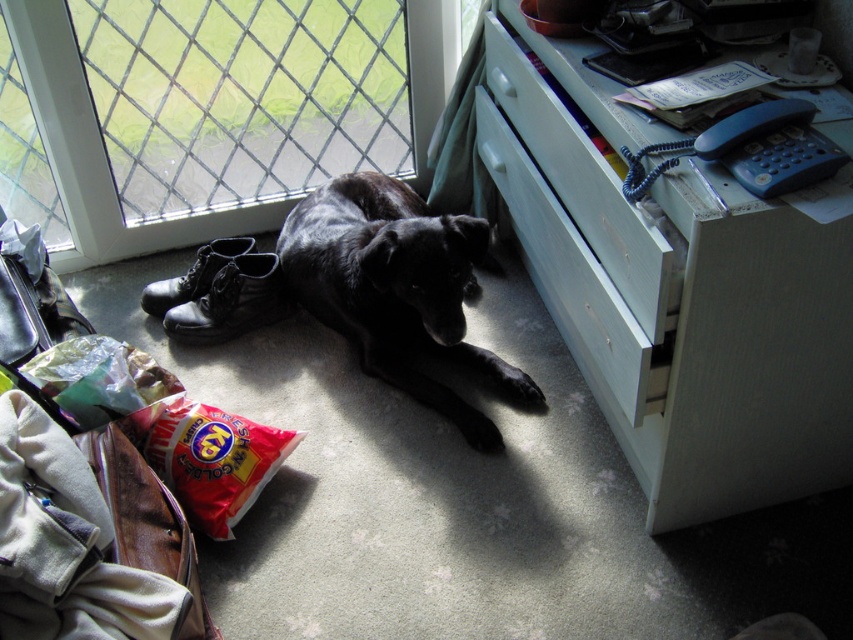
Is white wood file cabinet at right bigger than matte black boot at lower left?

Indeed, white wood file cabinet at right has a larger size compared to matte black boot at lower left.

Describe the element at coordinates (677, 291) in the screenshot. I see `white wood file cabinet at right` at that location.

Is point (718, 465) closer to viewer compared to point (224, 243)?

Yes, point (718, 465) is closer to viewer.

Where is `white wood file cabinet at right`? Image resolution: width=853 pixels, height=640 pixels. white wood file cabinet at right is located at coordinates 677,291.

Locate an element on the screen. velvet fabric bag at lower left is located at coordinates (67, 545).

Does velvet fabric bag at lower left have a smaller size compared to matte black boot at lower left?

No.

Can you confirm if velvet fabric bag at lower left is wider than matte black boot at lower left?

Correct, the width of velvet fabric bag at lower left exceeds that of matte black boot at lower left.

Identify the location of velvet fabric bag at lower left. (67, 545).